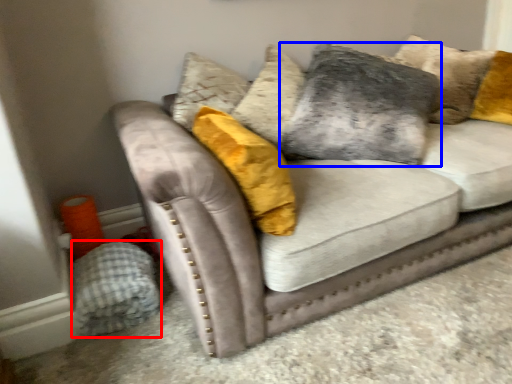
Question: Among these objects, which one is farthest to the camera, material (highlighted by a red box) or pillow (highlighted by a blue box)?

Choices:
 (A) material
 (B) pillow

Answer: (B)